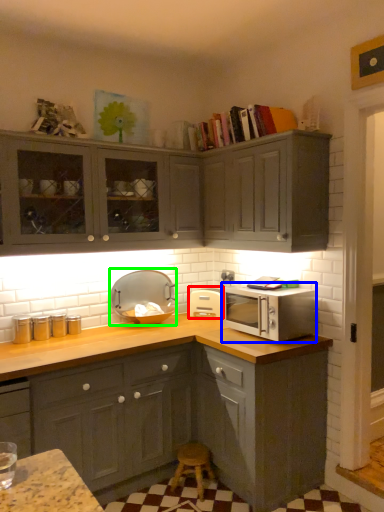
Question: Estimate the real-world distances between objects in this image. Which object is closer to appliance (highlighted by a red box), microwave oven (highlighted by a blue box) or appliance (highlighted by a green box)?

Choices:
 (A) microwave oven
 (B) appliance

Answer: (B)